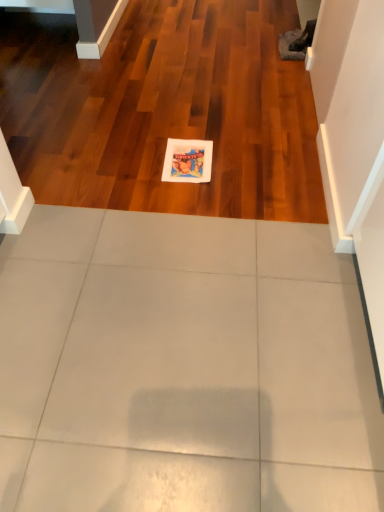
Question: In the image, is white glossy tile at center on the left side or the right side of matte paper postcard at center?

Choices:
 (A) left
 (B) right

Answer: (A)

Question: Relative to matte paper postcard at center, is white glossy tile at center in front or behind?

Choices:
 (A) front
 (B) behind

Answer: (A)

Question: From a real-world perspective, is white glossy tile at center positioned above or below matte paper postcard at center?

Choices:
 (A) above
 (B) below

Answer: (B)

Question: In the image, is matte paper postcard at center positioned in front of or behind white glossy tile at center?

Choices:
 (A) front
 (B) behind

Answer: (B)

Question: In terms of height, does matte paper postcard at center look taller or shorter compared to white glossy tile at center?

Choices:
 (A) tall
 (B) short

Answer: (B)

Question: From the image's perspective, is matte paper postcard at center positioned above or below white glossy tile at center?

Choices:
 (A) below
 (B) above

Answer: (A)

Question: Considering the positions of matte paper postcard at center and white glossy tile at center in the image, is matte paper postcard at center wider or thinner than white glossy tile at center?

Choices:
 (A) thin
 (B) wide

Answer: (A)